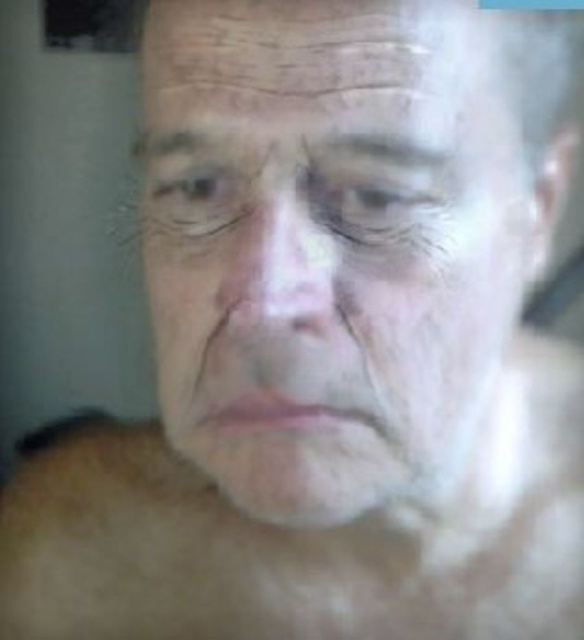
You are a dermatologist examining a patient. You notice the dry skin forehead at upper center and the translucent glass eye at center. How far apart are these two features on the patient?

The dry skin forehead at upper center is 6.13 centimeters away from the translucent glass eye at center.

You are a dermatologist examining a patient. You notice the brown matte eye at upper left and the dry skin wrinkle at center. How far apart are these two features on the patient?

The brown matte eye at upper left and dry skin wrinkle at center are 2.57 inches apart from each other.

You are a dermatologist examining a patient. You notice two features at the center of the face. What is the height comparison between the dry skin nose at center and the translucent glass eye at center?

The dry skin nose at center is much taller than the translucent glass eye at center.